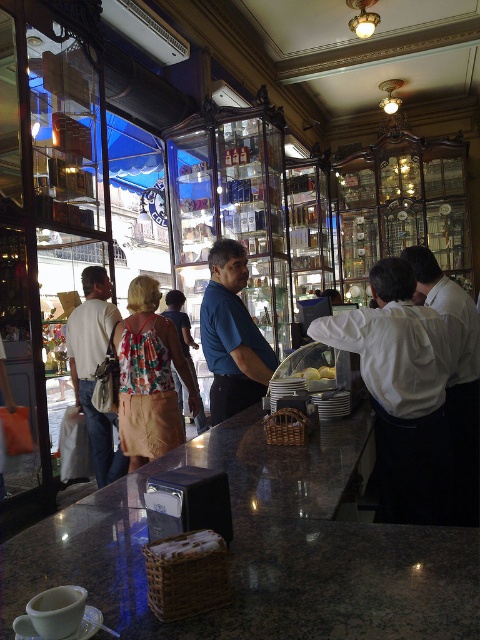
You are a customer at the bakery and want to place an order. You see the granite countertop at center and the blue smooth shirt at center. Which object is closer to the floor?

The granite countertop at center is below the blue smooth shirt at center, so it is closer to the floor.

You are a customer in the bakery and want to place an order. You see the granite countertop at center and the blue smooth shirt at center. Which object is larger in size?

The granite countertop at center is bigger than the blue smooth shirt at center.